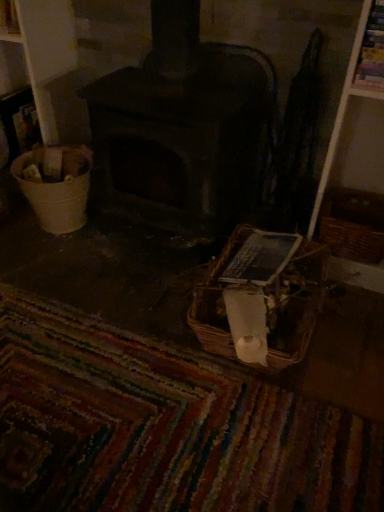
In order to face brown woven basket at right, which appears as the second basket when viewed from the left, should I rotate leftwards or rightwards?

It's best to rotate right around 21.118 degrees.

At what (x,y) coordinates should I click in order to perform the action: click on woven brown basket at lower center, the first basket in the left-to-right sequence. Please return your answer as a coordinate pair (x, y). The width and height of the screenshot is (384, 512). Looking at the image, I should click on (296, 305).

Is multicolored woven mat at lower center at the left side of woven brown basket at lower center, which is the 2th basket from right to left?

Correct, you'll find multicolored woven mat at lower center to the left of woven brown basket at lower center, which is the 2th basket from right to left.

Is point (56, 352) in front of point (215, 334)?

No, (56, 352) is further to viewer.

Is multicolored woven mat at lower center bigger than woven brown basket at lower center, the first basket in the left-to-right sequence?

Yes, multicolored woven mat at lower center is bigger than woven brown basket at lower center, the first basket in the left-to-right sequence.

Do you think multicolored woven mat at lower center is within woven brown basket at lower center, the first basket in the left-to-right sequence, or outside of it?

multicolored woven mat at lower center is not enclosed by woven brown basket at lower center, the first basket in the left-to-right sequence.

Considering the positions of objects brown woven basket at right, marked as the first basket in a right-to-left arrangement, and woven brown basket at lower center, which is the 2th basket from right to left, in the image provided, who is behind, brown woven basket at right, marked as the first basket in a right-to-left arrangement, or woven brown basket at lower center, which is the 2th basket from right to left,?

Positioned behind is brown woven basket at right, marked as the first basket in a right-to-left arrangement.

Measure the distance from brown woven basket at right, marked as the first basket in a right-to-left arrangement, to woven brown basket at lower center, which is the 2th basket from right to left.

A distance of 12.57 inches exists between brown woven basket at right, marked as the first basket in a right-to-left arrangement, and woven brown basket at lower center, which is the 2th basket from right to left.

Is point (350, 217) less distant than point (270, 348)?

No, (350, 217) is behind (270, 348).

In terms of height, does brown woven basket at right, which appears as the second basket when viewed from the left, look taller or shorter compared to woven brown basket at lower center, which is the 2th basket from right to left?

Clearly, brown woven basket at right, which appears as the second basket when viewed from the left, is taller compared to woven brown basket at lower center, which is the 2th basket from right to left.

Which is farther from the camera, (45,173) or (283,272)?

The point (45,173) is more distant.

From a real-world perspective, is white plastic bucket at left on woven brown basket at lower center, the first basket in the left-to-right sequence?

Yes, from a real-world perspective, white plastic bucket at left is above woven brown basket at lower center, the first basket in the left-to-right sequence.

Is white plastic bucket at left turned away from woven brown basket at lower center, which is the 2th basket from right to left?

white plastic bucket at left is not turned away from woven brown basket at lower center, which is the 2th basket from right to left.

In the scene shown: From the image's perspective, is white plastic bucket at left positioned above or below woven brown basket at lower center, the first basket in the left-to-right sequence?

white plastic bucket at left is above woven brown basket at lower center, the first basket in the left-to-right sequence.

From a real-world perspective, is multicolored woven mat at lower center physically above white plastic bucket at left?

Incorrect, from a real-world perspective, multicolored woven mat at lower center is lower than white plastic bucket at left.

Is white plastic bucket at left surrounded by multicolored woven mat at lower center?

Definitely not — white plastic bucket at left is not inside multicolored woven mat at lower center.

What are the coordinates of `mat that is in front of the white plastic bucket at left` in the screenshot? It's located at (162, 426).

Is multicolored woven mat at lower center positioned behind white plastic bucket at left?

No, multicolored woven mat at lower center is in front of white plastic bucket at left.

From the image's perspective, between brown woven basket at right, which appears as the second basket when viewed from the left, and dark gray stone wood burning stove at center, which one is located above?

From the image's view, dark gray stone wood burning stove at center is above.

Considering the positions of points (376, 208) and (202, 167), is point (376, 208) closer to camera compared to point (202, 167)?

No, (376, 208) is behind (202, 167).

Consider the image. From a real-world perspective, is brown woven basket at right, marked as the first basket in a right-to-left arrangement, on dark gray stone wood burning stove at center?

No, from a real-world perspective, brown woven basket at right, marked as the first basket in a right-to-left arrangement, is not over dark gray stone wood burning stove at center

The height and width of the screenshot is (512, 384). I want to click on wood burning stove behind the brown woven basket at right, which appears as the second basket when viewed from the left, so click(182, 126).

Looking at this image, are woven brown basket at lower center, the first basket in the left-to-right sequence, and brown woven basket at right, marked as the first basket in a right-to-left arrangement, far apart?

No.

Which object is closer to the camera taking this photo, woven brown basket at lower center, the first basket in the left-to-right sequence, or brown woven basket at right, marked as the first basket in a right-to-left arrangement?

woven brown basket at lower center, the first basket in the left-to-right sequence.

How much distance is there between woven brown basket at lower center, which is the 2th basket from right to left, and brown woven basket at right, marked as the first basket in a right-to-left arrangement?

woven brown basket at lower center, which is the 2th basket from right to left, and brown woven basket at right, marked as the first basket in a right-to-left arrangement, are 12.57 inches apart.

Where is `basket above the woven brown basket at lower center, the first basket in the left-to-right sequence (from a real-world perspective)`? The image size is (384, 512). basket above the woven brown basket at lower center, the first basket in the left-to-right sequence (from a real-world perspective) is located at coordinates (353, 225).

How much distance is there between multicolored woven mat at lower center and brown woven basket at right, marked as the first basket in a right-to-left arrangement?

32.20 inches.

Is multicolored woven mat at lower center at the left side of brown woven basket at right, which appears as the second basket when viewed from the left?

Indeed, multicolored woven mat at lower center is positioned on the left side of brown woven basket at right, which appears as the second basket when viewed from the left.

Based on the photo, from a real-world perspective, is multicolored woven mat at lower center positioned above or below brown woven basket at right, which appears as the second basket when viewed from the left?

multicolored woven mat at lower center is below brown woven basket at right, which appears as the second basket when viewed from the left.

Does multicolored woven mat at lower center lie behind brown woven basket at right, which appears as the second basket when viewed from the left?

No, the depth of multicolored woven mat at lower center is less than that of brown woven basket at right, which appears as the second basket when viewed from the left.

Locate an element on the screen. The width and height of the screenshot is (384, 512). mat below the woven brown basket at lower center, which is the 2th basket from right to left (from the image's perspective) is located at coordinates (162, 426).

Locate an element on the screen. This screenshot has width=384, height=512. basket below the brown woven basket at right, marked as the first basket in a right-to-left arrangement (from a real-world perspective) is located at coordinates (296, 305).

From the image, which object appears to be farther from multicolored woven mat at lower center, woven brown basket at lower center, which is the 2th basket from right to left, or brown woven basket at right, marked as the first basket in a right-to-left arrangement?

brown woven basket at right, marked as the first basket in a right-to-left arrangement, is further to multicolored woven mat at lower center.

Based on their spatial positions, is brown woven basket at right, marked as the first basket in a right-to-left arrangement, or dark gray stone wood burning stove at center closer to multicolored woven mat at lower center?

dark gray stone wood burning stove at center lies closer to multicolored woven mat at lower center than the other object.

Considering their positions, is dark gray stone wood burning stove at center positioned closer to brown woven basket at right, which appears as the second basket when viewed from the left, than white plastic bucket at left?

dark gray stone wood burning stove at center is closer to brown woven basket at right, which appears as the second basket when viewed from the left.

Considering their positions, is multicolored woven mat at lower center positioned closer to white plastic bucket at left than woven brown basket at lower center, the first basket in the left-to-right sequence?

Among the two, multicolored woven mat at lower center is located nearer to white plastic bucket at left.

Based on their spatial positions, is multicolored woven mat at lower center or brown woven basket at right, marked as the first basket in a right-to-left arrangement, closer to white plastic bucket at left?

The object closer to white plastic bucket at left is multicolored woven mat at lower center.

Which object lies further to the anchor point woven brown basket at lower center, the first basket in the left-to-right sequence, brown woven basket at right, marked as the first basket in a right-to-left arrangement, or white plastic bucket at left?

white plastic bucket at left is positioned further to the anchor woven brown basket at lower center, the first basket in the left-to-right sequence.

Estimate the real-world distances between objects in this image. Which object is further from brown woven basket at right, which appears as the second basket when viewed from the left, white plastic bucket at left or multicolored woven mat at lower center?

white plastic bucket at left is further to brown woven basket at right, which appears as the second basket when viewed from the left.

From the image, which object appears to be farther from brown woven basket at right, which appears as the second basket when viewed from the left, multicolored woven mat at lower center or dark gray stone wood burning stove at center?

The object further to brown woven basket at right, which appears as the second basket when viewed from the left, is multicolored woven mat at lower center.

This screenshot has width=384, height=512. Identify the location of wood burning stove located between white plastic bucket at left and brown woven basket at right, marked as the first basket in a right-to-left arrangement, in the left-right direction. (182, 126).

Identify the location of basket situated between white plastic bucket at left and brown woven basket at right, marked as the first basket in a right-to-left arrangement, from left to right. This screenshot has height=512, width=384. (296, 305).

Find the location of `mat located between white plastic bucket at left and woven brown basket at lower center, the first basket in the left-to-right sequence, in the left-right direction`. mat located between white plastic bucket at left and woven brown basket at lower center, the first basket in the left-to-right sequence, in the left-right direction is located at coordinates (162, 426).

Locate an element on the screen. This screenshot has height=512, width=384. basket between dark gray stone wood burning stove at center and woven brown basket at lower center, the first basket in the left-to-right sequence, in the up-down direction is located at coordinates (353, 225).